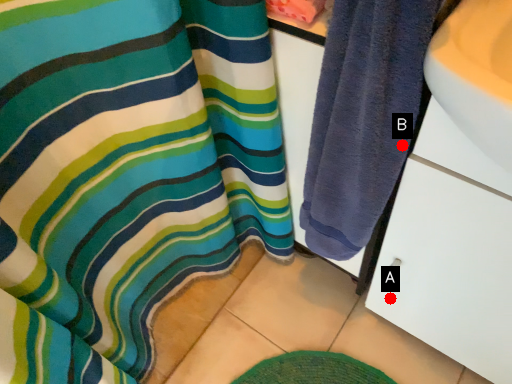
Question: Two points are circled on the image, labeled by A and B beside each circle. Which point appears farthest from the camera in this image?

Choices:
 (A) A is further
 (B) B is further

Answer: (A)